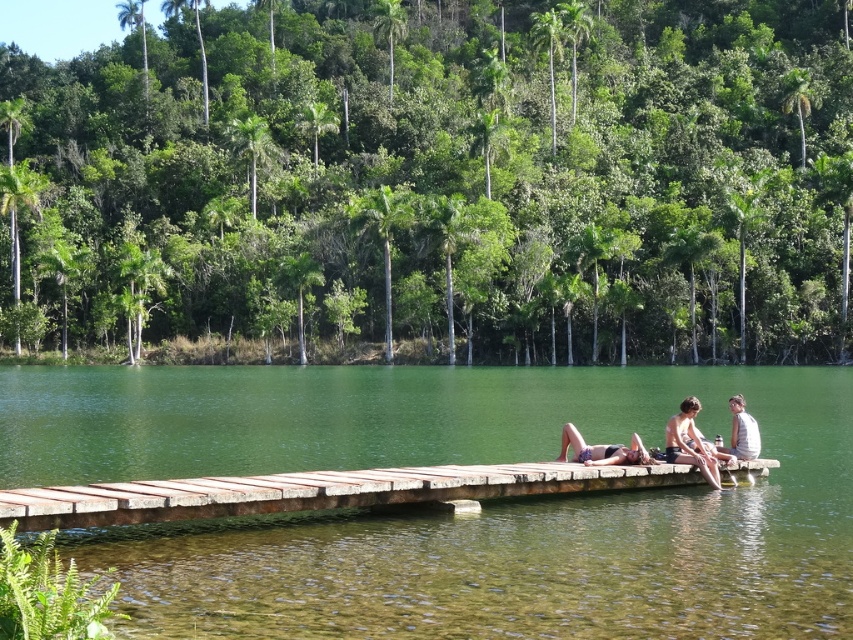
You are a photographer standing on the wooden dock. You want to take a photo of the green translucent water at center and the beige fabric towel at center. How far apart are these two objects in the scene?

The green translucent water at center is 13.93 meters from the beige fabric towel at center.

You are a photographer standing on the wooden dock and want to take a photo of the green translucent water at center and the beige fabric towel at center. Which object should you focus on first if you want to capture both in the same frame without moving your camera?

The beige fabric towel at center should be focused on first because the green translucent water at center is positioned to its right, so adjusting focus from the towel to the water would keep both in the frame without moving the camera.